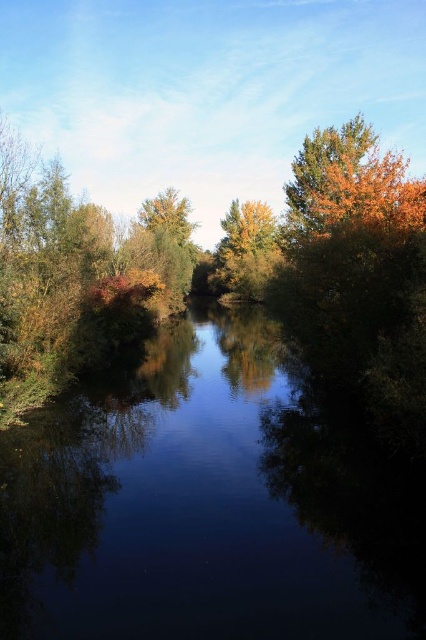
You are standing at the riverside and see the dark reflective water at center and the green matte tree at center. Which object is shorter in height?

A: The dark reflective water at center has a lesser height compared to the green matte tree at center, so the dark reflective water at center is shorter.

You are standing at the edge of the river and see the dark reflective water at center and the green matte tree at center. Which object is closer to the ground?

The dark reflective water at center is below green matte tree at center, so it is closer to the ground.